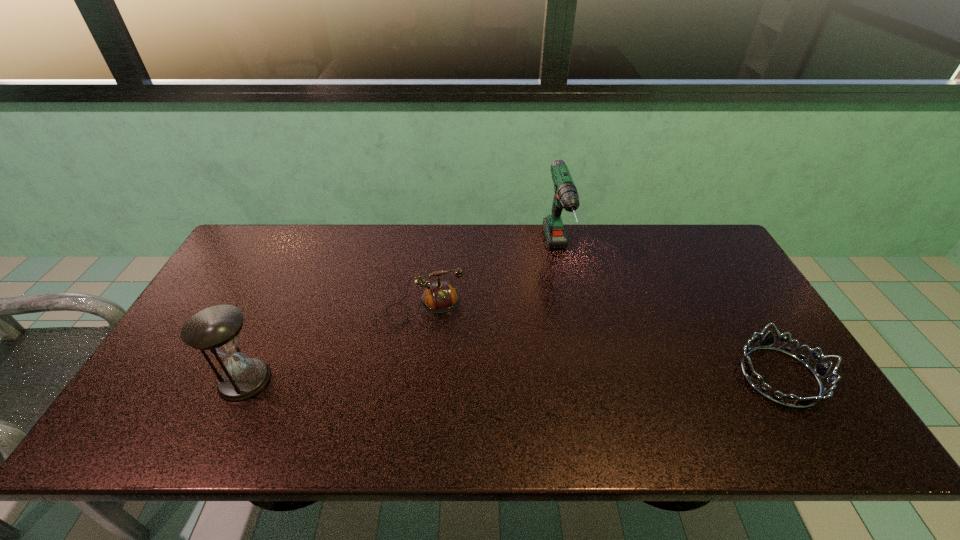
The width and height of the screenshot is (960, 540). In order to click on the third shortest object in this screenshot , I will do `click(216, 329)`.

At what (x,y) coordinates should I click in order to perform the action: click on the leftmost object. Please return your answer as a coordinate pair (x, y). Looking at the image, I should click on (216, 329).

In order to click on the rightmost object in this screenshot , I will do `click(820, 370)`.

Where is `tiara`? This screenshot has height=540, width=960. tiara is located at coordinates (820, 370).

Identify the location of the second shortest object. This screenshot has height=540, width=960. (x=439, y=297).

Where is `the third object from right to left`? The height and width of the screenshot is (540, 960). the third object from right to left is located at coordinates (439, 297).

The height and width of the screenshot is (540, 960). What are the coordinates of `the third object from left to right` in the screenshot? It's located at (566, 197).

Find the location of a particular element. The width and height of the screenshot is (960, 540). drill is located at coordinates (566, 197).

Where is `vacant space located 0.200m on the back of the hourglass`? vacant space located 0.200m on the back of the hourglass is located at coordinates click(280, 305).

You are a GUI agent. You are given a task and a screenshot of the screen. Output one action in this format:
    pyautogui.click(x=<x>, y=<y>)
    Task: Click on the free space located on the rotary dial of the third tallest object
    This screenshot has width=960, height=540.
    Given the screenshot: What is the action you would take?
    pyautogui.click(x=447, y=383)